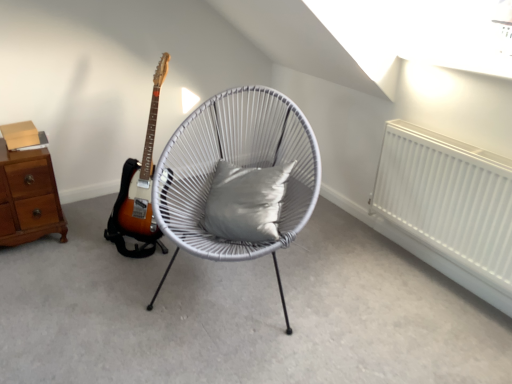
At what (x,y) coordinates should I click in order to perform the action: click on free area below white woven chair at center (from a real-world perspective). Please return your answer as a coordinate pair (x, y). This screenshot has height=384, width=512. Looking at the image, I should click on (247, 280).